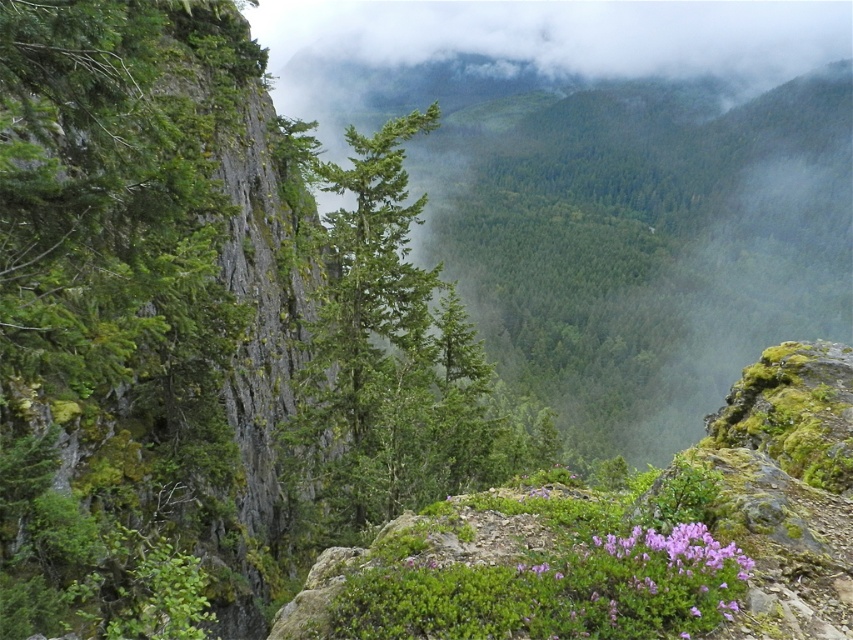
You are a hiker who wants to take a photo of the purple matte flower at lower right without the green matte tree at center blocking the view. Can you move to a position where the flower is visible without the tree in front of it?

The green matte tree at center is positioned over the purple matte flower at lower right, so moving behind the tree might allow you to see the flower without the tree blocking it.

You are a hiker standing at the edge of the rocky terrain. You see the green matte tree at center and the purple matte flower at lower right. Which object is positioned to the right side of the other?

The green matte tree at center is to the left of the purple matte flower at lower right, so the purple matte flower at lower right is positioned to the right side of the green matte tree at center.

You are a hiker standing at the edge of the rocky terrain. You see the green matte tree at center and the purple matte flower at lower right. Which object is taller?

The green matte tree at center is much taller than the purple matte flower at lower right.